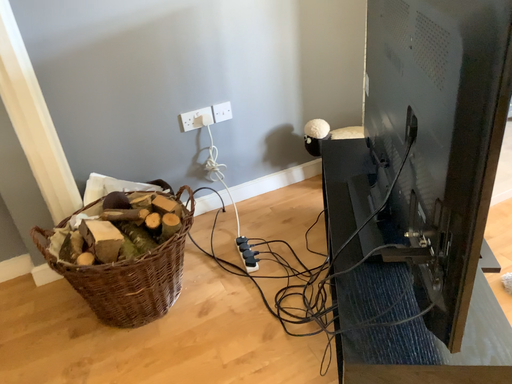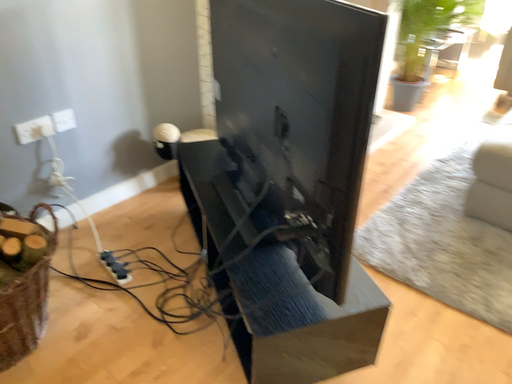
Question: How did the camera likely rotate when shooting the video?

Choices:
 (A) rotated left
 (B) rotated right

Answer: (B)